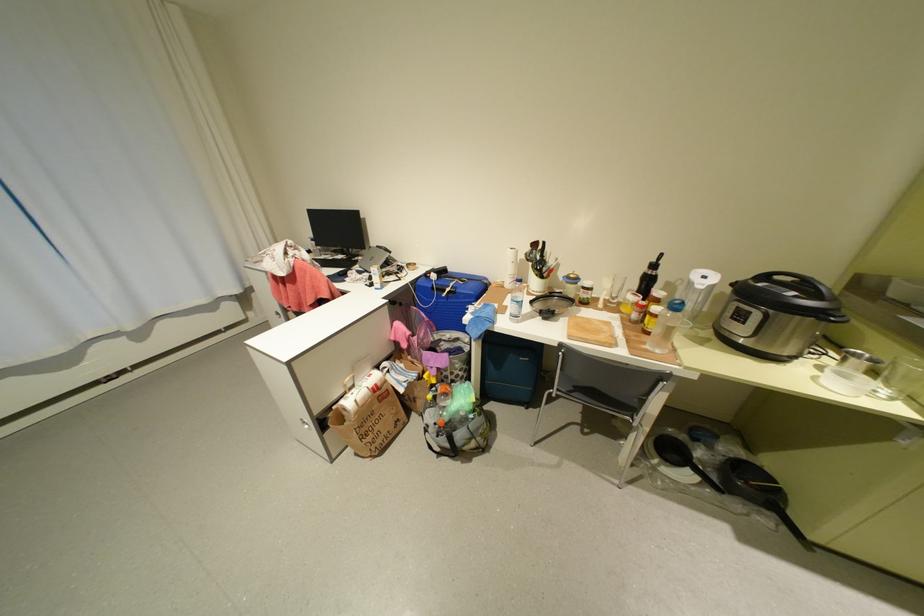
Find where to turn the pressure cooker handle. Please return your answer as a coordinate pair (x, y).

(834, 315)